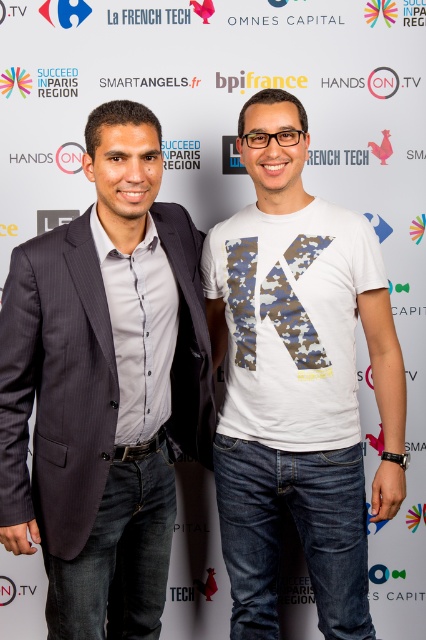
Does dark gray pinstripe suit at left have a lesser height compared to white matte t-shirt at center?

Indeed, dark gray pinstripe suit at left has a lesser height compared to white matte t-shirt at center.

Between dark gray pinstripe suit at left and white matte t-shirt at center, which one is positioned lower?

dark gray pinstripe suit at left is lower down.

Where is `dark gray pinstripe suit at left`? dark gray pinstripe suit at left is located at coordinates (104, 387).

Between white matte t-shirt at center and camo fabric t-shirt at center, which one is positioned lower?

white matte t-shirt at center

Is point (393, 378) behind point (287, 326)?

Yes, point (393, 378) is farther from viewer.

The width and height of the screenshot is (426, 640). Describe the element at coordinates (298, 381) in the screenshot. I see `white matte t-shirt at center` at that location.

Identify the location of white matte t-shirt at center. (298, 381).

Who is positioned more to the left, dark gray pinstripe suit at left or camo fabric t-shirt at center?

Positioned to the left is dark gray pinstripe suit at left.

Between dark gray pinstripe suit at left and camo fabric t-shirt at center, which one appears on the right side from the viewer's perspective?

From the viewer's perspective, camo fabric t-shirt at center appears more on the right side.

I want to click on dark gray pinstripe suit at left, so click(x=104, y=387).

Image resolution: width=426 pixels, height=640 pixels. In order to click on dark gray pinstripe suit at left in this screenshot , I will do `click(104, 387)`.